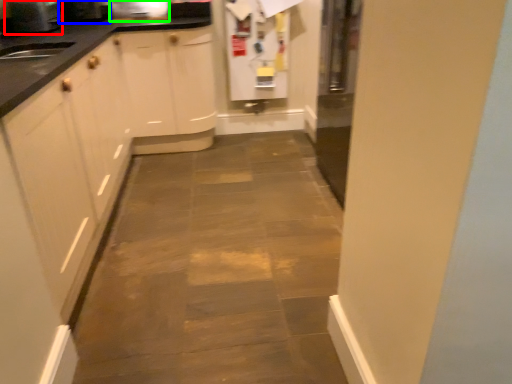
Question: Estimate the real-world distances between objects in this image. Which object is farther from appliance (highlighted by a red box), appliance (highlighted by a blue box) or appliance (highlighted by a green box)?

Choices:
 (A) appliance
 (B) appliance

Answer: (B)